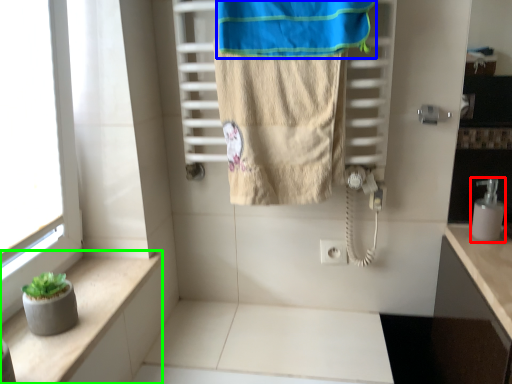
Question: Which object is the farthest from soap dispenser (highlighted by a red box)? Choose among these: beach towel (highlighted by a blue box) or balustrade (highlighted by a green box).

Choices:
 (A) beach towel
 (B) balustrade

Answer: (B)